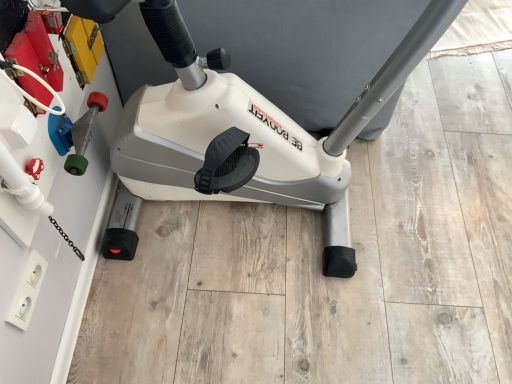
At what (x,y) coordinates should I click in order to perform the action: click on unoccupied region to the right of white matte stationary bicycle at center. Please return your answer as a coordinate pair (x, y). Image resolution: width=512 pixels, height=384 pixels. Looking at the image, I should click on (452, 200).